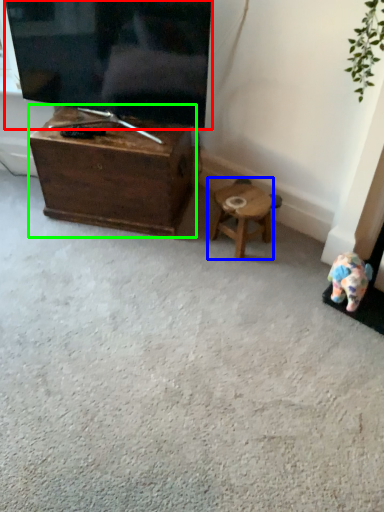
Question: Which is nearer to the television (highlighted by a red box)? stool (highlighted by a blue box) or table (highlighted by a green box).

Choices:
 (A) stool
 (B) table

Answer: (B)